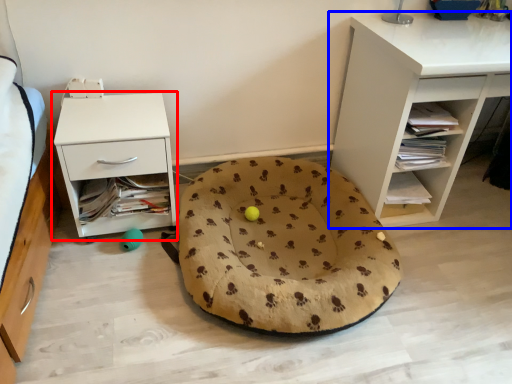
Question: Which of the following is the closest to the observer, nightstand (highlighted by a red box) or shelf (highlighted by a blue box)?

Choices:
 (A) nightstand
 (B) shelf

Answer: (B)